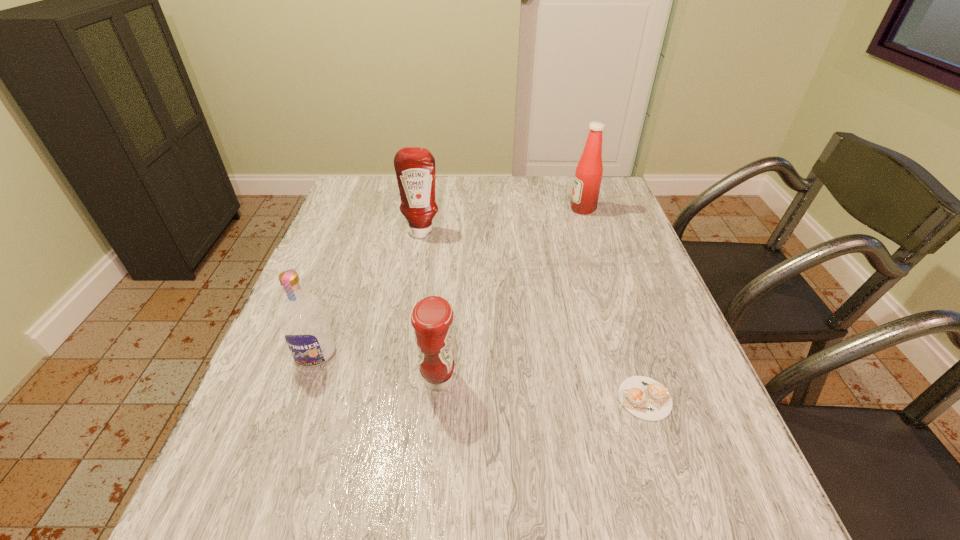
This screenshot has height=540, width=960. Find the location of `the farthest condiment`. the farthest condiment is located at coordinates (588, 176).

The width and height of the screenshot is (960, 540). I want to click on the rightmost condiment, so click(588, 176).

Find the location of a particular element. the fourth nearest object is located at coordinates (415, 167).

This screenshot has width=960, height=540. In order to click on vodka in this screenshot , I will do `click(302, 317)`.

Where is `the shortest condiment`? the shortest condiment is located at coordinates (431, 318).

Locate an element on the screen. Image resolution: width=960 pixels, height=540 pixels. the shortest object is located at coordinates (645, 398).

I want to click on vacant space positioned 0.390m on the front-facing side of the farthest object, so click(446, 209).

You are a GUI agent. You are given a task and a screenshot of the screen. Output one action in this format:
    pyautogui.click(x=<x>, y=<y>)
    Task: Click on the vacant region located 0.140m on the front-facing side of the farthest object
    The image size is (960, 540).
    Given the screenshot: What is the action you would take?
    pyautogui.click(x=526, y=209)

Where is `vacant space located on the front-facing side of the farthest object`? This screenshot has width=960, height=540. vacant space located on the front-facing side of the farthest object is located at coordinates (519, 209).

You are a GUI agent. You are given a task and a screenshot of the screen. Output one action in this format:
    pyautogui.click(x=<x>, y=<y>)
    Task: Click on the vacant area located on the front of the fourth nearest object
    This screenshot has width=960, height=540.
    Given the screenshot: What is the action you would take?
    pyautogui.click(x=405, y=323)